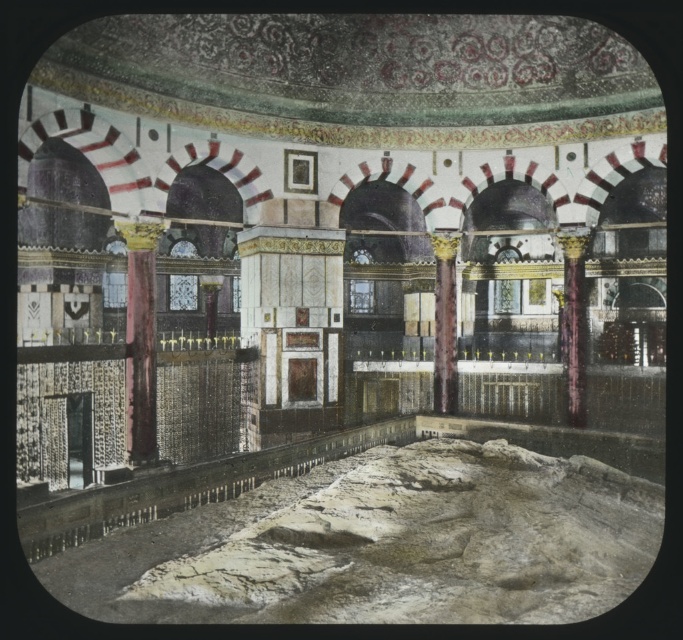
Consider the image. Which is more to the right, marble column at center or maroon polished column at center?

Positioned to the right is marble column at center.

Is marble column at center to the right of maroon polished column at center from the viewer's perspective?

Indeed, marble column at center is positioned on the right side of maroon polished column at center.

Is point (571, 291) farther from camera compared to point (434, 284)?

No.

Locate an element on the screen. This screenshot has width=683, height=640. marble column at center is located at coordinates (572, 321).